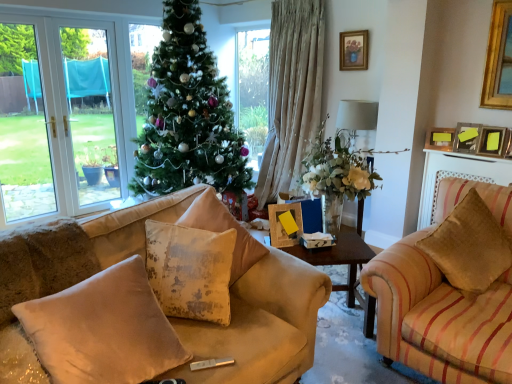
Question: Could you tell me if gold-framed picture at upper center, the 4th picture frame when ordered from right to left, is facing wooden picture frame at upper right, marked as the fourth picture frame in a back-to-front arrangement?

Choices:
 (A) yes
 (B) no

Answer: (B)

Question: From a real-world perspective, is gold-framed picture at upper center, which is the 4th picture frame in front-to-back order, over wooden picture frame at upper right, the 1th picture frame in the bottom-to-top sequence?

Choices:
 (A) no
 (B) yes

Answer: (B)

Question: Is gold-framed picture at upper center, arranged as the 1th picture frame when viewed from the top, looking in the opposite direction of wooden picture frame at upper right, marked as the first picture frame in a right-to-left arrangement?

Choices:
 (A) no
 (B) yes

Answer: (A)

Question: Can you confirm if gold-framed picture at upper center, which is the 4th picture frame in front-to-back order, is bigger than wooden picture frame at upper right, which is the 4th picture frame from top to bottom?

Choices:
 (A) yes
 (B) no

Answer: (B)

Question: From the image's perspective, does gold-framed picture at upper center, which ranks as the first picture frame in left-to-right order, appear lower than wooden picture frame at upper right, marked as the first picture frame in a right-to-left arrangement?

Choices:
 (A) yes
 (B) no

Answer: (B)

Question: From the image's perspective, is translucent glass vase at center above or below wooden picture frame at upper right, which appears as the 2th picture frame when viewed from the top?

Choices:
 (A) above
 (B) below

Answer: (B)

Question: Considering their positions, is translucent glass vase at center located in front of or behind wooden picture frame at upper right, the 3th picture frame positioned from the front?

Choices:
 (A) behind
 (B) front

Answer: (B)

Question: Is translucent glass vase at center taller or shorter than wooden picture frame at upper right, placed as the second picture frame when sorted from back to front?

Choices:
 (A) short
 (B) tall

Answer: (B)

Question: Does point (366, 122) appear closer or farther from the camera than point (437, 144)?

Choices:
 (A) closer
 (B) farther

Answer: (B)

Question: From their relative heights in the image, would you say beige velvet pillow at lower left, the 1th pillow in the left-to-right sequence, is taller or shorter than wooden picture frame at upper right, which appears as the 2th picture frame when ordered from the bottom?

Choices:
 (A) short
 (B) tall

Answer: (B)

Question: Visually, is beige velvet pillow at lower left, the 1th pillow in the left-to-right sequence, positioned to the left or to the right of wooden picture frame at upper right, the second picture frame when ordered from right to left?

Choices:
 (A) right
 (B) left

Answer: (B)

Question: Is beige velvet pillow at lower left, arranged as the fourth pillow when viewed from the right, bigger or smaller than wooden picture frame at upper right, which appears as the 2th picture frame when ordered from the bottom?

Choices:
 (A) big
 (B) small

Answer: (A)

Question: Is point (95, 304) positioned closer to the camera than point (461, 135)?

Choices:
 (A) closer
 (B) farther

Answer: (A)

Question: Considering the positions of translucent glass vase at center and transparent glass lamp at center in the image, is translucent glass vase at center bigger or smaller than transparent glass lamp at center?

Choices:
 (A) big
 (B) small

Answer: (A)

Question: From the image's perspective, relative to transparent glass lamp at center, is translucent glass vase at center above or below?

Choices:
 (A) below
 (B) above

Answer: (A)